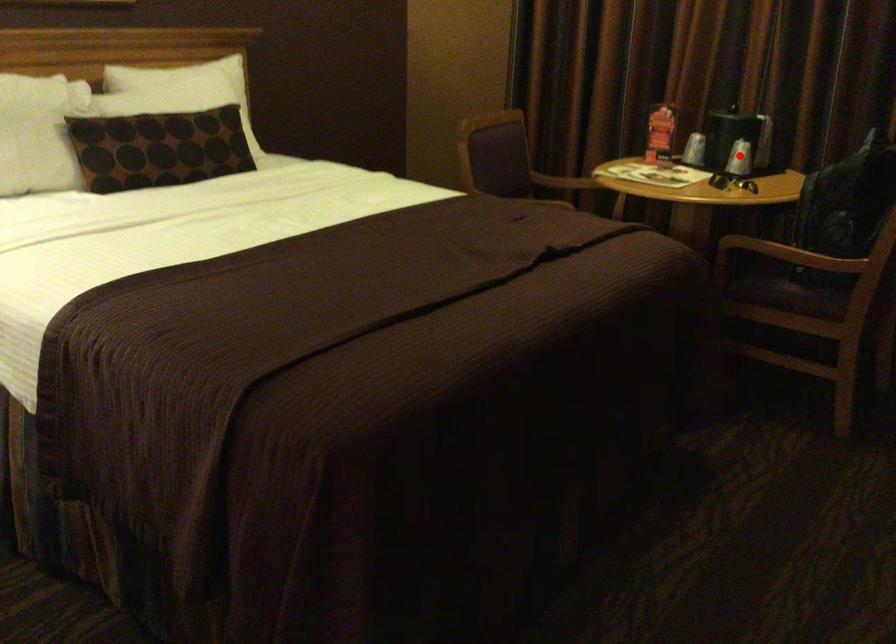
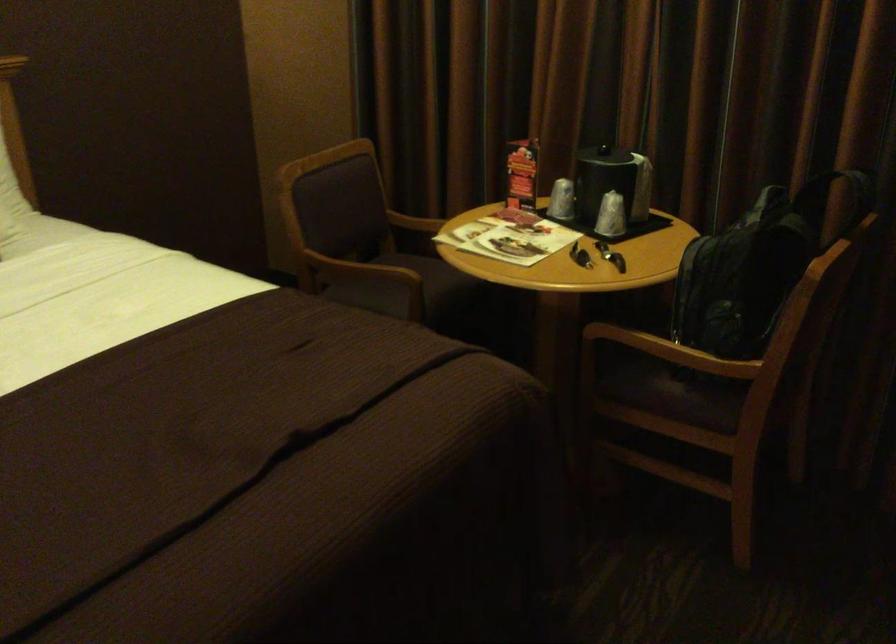
Question: I am providing you with two images of the same scene from different viewpoints. Given a red point in image1, look at the same physical point in image2. Is it:

Choices:
 (A) Closer to the viewpoint
 (B) Farther from the viewpoint

Answer: (A)